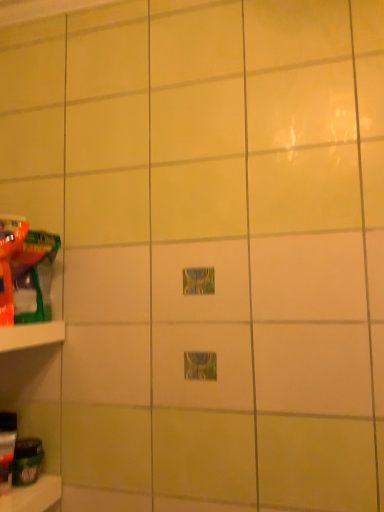
The image size is (384, 512). What do you see at coordinates (27, 461) in the screenshot?
I see `green matte jar at lower left, which is counted as the first toy, starting from the bottom` at bounding box center [27, 461].

What do you see at coordinates (29, 267) in the screenshot? Image resolution: width=384 pixels, height=512 pixels. I see `matte plastic toy at left, which is the third toy from bottom to top` at bounding box center [29, 267].

The image size is (384, 512). Describe the element at coordinates (31, 335) in the screenshot. I see `white plastic shelf at left` at that location.

In order to click on translucent plastic bottle at lower left, positioned as the 3th toy in top-to-bottom order in this screenshot , I will do `click(7, 448)`.

Would you say white plastic shelf at left is to the left or to the right of green matte jar at lower left, which is counted as the first toy, starting from the bottom, in the picture?

From the image, it's evident that white plastic shelf at left is to the left of green matte jar at lower left, which is counted as the first toy, starting from the bottom.

Does point (58, 331) come in front of point (22, 439)?

Yes, it is.

How distant is white plastic shelf at left from green matte jar at lower left, which appears as the 4th toy when viewed from the top?

white plastic shelf at left and green matte jar at lower left, which appears as the 4th toy when viewed from the top, are 11.34 inches apart from each other.

From the picture: Between white plastic shelf at left and matte plastic toy at left, placed as the 2th toy when sorted from top to bottom, which one has larger width?

Wider between the two is matte plastic toy at left, placed as the 2th toy when sorted from top to bottom.

From a real-world perspective, who is located lower, white plastic shelf at left or matte plastic toy at left, which is the third toy from bottom to top?

white plastic shelf at left, from a real-world perspective.

Is white plastic shelf at left oriented away from matte plastic toy at left, which is the third toy from bottom to top?

No, white plastic shelf at left is not facing away from matte plastic toy at left, which is the third toy from bottom to top.

Measure the distance between white plastic shelf at left and matte plastic toy at left, placed as the 2th toy when sorted from top to bottom.

white plastic shelf at left is 11.04 centimeters from matte plastic toy at left, placed as the 2th toy when sorted from top to bottom.

Could translucent plastic bottle at lower left, positioned as the 3th toy in top-to-bottom order, be considered to be inside matte plastic toy at left, placed as the 2th toy when sorted from top to bottom?

Definitely not — translucent plastic bottle at lower left, positioned as the 3th toy in top-to-bottom order, is not inside matte plastic toy at left, placed as the 2th toy when sorted from top to bottom.

Is matte plastic toy at left, placed as the 2th toy when sorted from top to bottom, turned away from translucent plastic bottle at lower left, arranged as the second toy when ordered from the bottom?

No, matte plastic toy at left, placed as the 2th toy when sorted from top to bottom, is not facing the opposite direction of translucent plastic bottle at lower left, arranged as the second toy when ordered from the bottom.

Is matte plastic toy at left, placed as the 2th toy when sorted from top to bottom, bigger than translucent plastic bottle at lower left, positioned as the 3th toy in top-to-bottom order?

Correct, matte plastic toy at left, placed as the 2th toy when sorted from top to bottom, is larger in size than translucent plastic bottle at lower left, positioned as the 3th toy in top-to-bottom order.

How many degrees apart are the facing directions of matte plastic toy at left, which is the third toy from bottom to top, and white plastic shelf at left?

1.56e-05 degrees.

Is matte plastic toy at left, which is the third toy from bottom to top, outside of white plastic shelf at left?

matte plastic toy at left, which is the third toy from bottom to top, lies outside white plastic shelf at left's area.

How far apart are matte plastic toy at left, which is the third toy from bottom to top, and white plastic shelf at left?

The distance of matte plastic toy at left, which is the third toy from bottom to top, from white plastic shelf at left is 4.35 inches.

Looking at this image, is matte plastic toy at left, placed as the 2th toy when sorted from top to bottom, positioned in front of white plastic shelf at left?

No, matte plastic toy at left, placed as the 2th toy when sorted from top to bottom, is further to the viewer.

Which is more to the right, white plastic shelf at left or translucent plastic toy at left, the first toy in the top-to-bottom sequence?

translucent plastic toy at left, the first toy in the top-to-bottom sequence, is more to the right.

Can you see white plastic shelf at left touching translucent plastic toy at left, the fourth toy when ordered from bottom to top?

No, white plastic shelf at left is not beside translucent plastic toy at left, the fourth toy when ordered from bottom to top.

In terms of height, does white plastic shelf at left look taller or shorter compared to translucent plastic toy at left, the first toy in the top-to-bottom sequence?

In the image, white plastic shelf at left appears to be shorter than translucent plastic toy at left, the first toy in the top-to-bottom sequence.

Could you tell me if white plastic shelf at left is turned towards translucent plastic toy at left, the fourth toy when ordered from bottom to top?

No.

I want to click on the 1st toy in front of the matte plastic toy at left, which is the third toy from bottom to top, starting your count from the anchor, so click(x=27, y=461).

From the image's perspective, would you say green matte jar at lower left, which appears as the 4th toy when viewed from the top, is shown under matte plastic toy at left, placed as the 2th toy when sorted from top to bottom?

Yes, from the image's perspective, green matte jar at lower left, which appears as the 4th toy when viewed from the top, is beneath matte plastic toy at left, placed as the 2th toy when sorted from top to bottom.

Which object is positioned more to the right, green matte jar at lower left, which is counted as the first toy, starting from the bottom, or matte plastic toy at left, placed as the 2th toy when sorted from top to bottom?

From the viewer's perspective, green matte jar at lower left, which is counted as the first toy, starting from the bottom, appears more on the right side.

How many degrees apart are the facing directions of green matte jar at lower left, which appears as the 4th toy when viewed from the top, and matte plastic toy at left, which is the third toy from bottom to top?

green matte jar at lower left, which appears as the 4th toy when viewed from the top, and matte plastic toy at left, which is the third toy from bottom to top, are facing 1.37 degrees away from each other.

Is translucent plastic toy at left, the fourth toy when ordered from bottom to top, further to the viewer compared to green matte jar at lower left, which is counted as the first toy, starting from the bottom?

No, translucent plastic toy at left, the fourth toy when ordered from bottom to top, is in front of green matte jar at lower left, which is counted as the first toy, starting from the bottom.

Who is taller, translucent plastic toy at left, the first toy in the top-to-bottom sequence, or green matte jar at lower left, which is counted as the first toy, starting from the bottom?

translucent plastic toy at left, the first toy in the top-to-bottom sequence, is taller.

In the image, is translucent plastic toy at left, the first toy in the top-to-bottom sequence, on the left side or the right side of green matte jar at lower left, which appears as the 4th toy when viewed from the top?

From the image, it's evident that translucent plastic toy at left, the first toy in the top-to-bottom sequence, is to the left of green matte jar at lower left, which appears as the 4th toy when viewed from the top.

Considering the positions of points (5, 222) and (17, 457), is point (5, 222) closer to camera compared to point (17, 457)?

Yes, it is in front of point (17, 457).

This screenshot has width=384, height=512. I want to click on shelf on the left side of green matte jar at lower left, which is counted as the first toy, starting from the bottom, so click(x=31, y=335).

The image size is (384, 512). I want to click on shelf in front of the matte plastic toy at left, which is the third toy from bottom to top, so click(31, 335).

Based on their spatial positions, is matte plastic toy at left, placed as the 2th toy when sorted from top to bottom, or translucent plastic bottle at lower left, arranged as the second toy when ordered from the bottom, further from green matte jar at lower left, which appears as the 4th toy when viewed from the top?

matte plastic toy at left, placed as the 2th toy when sorted from top to bottom, is further to green matte jar at lower left, which appears as the 4th toy when viewed from the top.

Considering their positions, is white plastic shelf at left positioned closer to green matte jar at lower left, which appears as the 4th toy when viewed from the top, than translucent plastic toy at left, the fourth toy when ordered from bottom to top?

white plastic shelf at left is positioned closer to the anchor green matte jar at lower left, which appears as the 4th toy when viewed from the top.

Which object lies nearer to the anchor point translucent plastic bottle at lower left, arranged as the second toy when ordered from the bottom, translucent plastic toy at left, the fourth toy when ordered from bottom to top, or white plastic shelf at left?

Among the two, white plastic shelf at left is located nearer to translucent plastic bottle at lower left, arranged as the second toy when ordered from the bottom.

Consider the image. Considering their positions, is matte plastic toy at left, placed as the 2th toy when sorted from top to bottom, positioned further to translucent plastic toy at left, the fourth toy when ordered from bottom to top, than green matte jar at lower left, which appears as the 4th toy when viewed from the top?

green matte jar at lower left, which appears as the 4th toy when viewed from the top, lies further to translucent plastic toy at left, the fourth toy when ordered from bottom to top, than the other object.

Estimate the real-world distances between objects in this image. Which object is further from translucent plastic toy at left, the fourth toy when ordered from bottom to top, translucent plastic bottle at lower left, positioned as the 3th toy in top-to-bottom order, or white plastic shelf at left?

Among the two, translucent plastic bottle at lower left, positioned as the 3th toy in top-to-bottom order, is located further to translucent plastic toy at left, the fourth toy when ordered from bottom to top.

Based on their spatial positions, is green matte jar at lower left, which is counted as the first toy, starting from the bottom, or matte plastic toy at left, placed as the 2th toy when sorted from top to bottom, closer to white plastic shelf at left?

matte plastic toy at left, placed as the 2th toy when sorted from top to bottom, lies closer to white plastic shelf at left than the other object.

Looking at the image, which one is located closer to translucent plastic toy at left, the fourth toy when ordered from bottom to top, white plastic shelf at left or matte plastic toy at left, which is the third toy from bottom to top?

matte plastic toy at left, which is the third toy from bottom to top, lies closer to translucent plastic toy at left, the fourth toy when ordered from bottom to top, than the other object.

From the image, which object appears to be farther from white plastic shelf at left, translucent plastic bottle at lower left, positioned as the 3th toy in top-to-bottom order, or matte plastic toy at left, which is the third toy from bottom to top?

The object further to white plastic shelf at left is translucent plastic bottle at lower left, positioned as the 3th toy in top-to-bottom order.

The image size is (384, 512). Identify the location of toy that lies between matte plastic toy at left, which is the third toy from bottom to top, and green matte jar at lower left, which appears as the 4th toy when viewed from the top, from top to bottom. (7, 448).

Locate an element on the screen. shelf between translucent plastic toy at left, the fourth toy when ordered from bottom to top, and translucent plastic bottle at lower left, arranged as the second toy when ordered from the bottom, vertically is located at coordinates coord(31,335).

Find the location of a particular element. The height and width of the screenshot is (512, 384). toy between white plastic shelf at left and green matte jar at lower left, which is counted as the first toy, starting from the bottom, from top to bottom is located at coordinates (7, 448).

Where is `toy between translucent plastic toy at left, the fourth toy when ordered from bottom to top, and translucent plastic bottle at lower left, arranged as the second toy when ordered from the bottom, from top to bottom`? The height and width of the screenshot is (512, 384). toy between translucent plastic toy at left, the fourth toy when ordered from bottom to top, and translucent plastic bottle at lower left, arranged as the second toy when ordered from the bottom, from top to bottom is located at coordinates (29, 267).